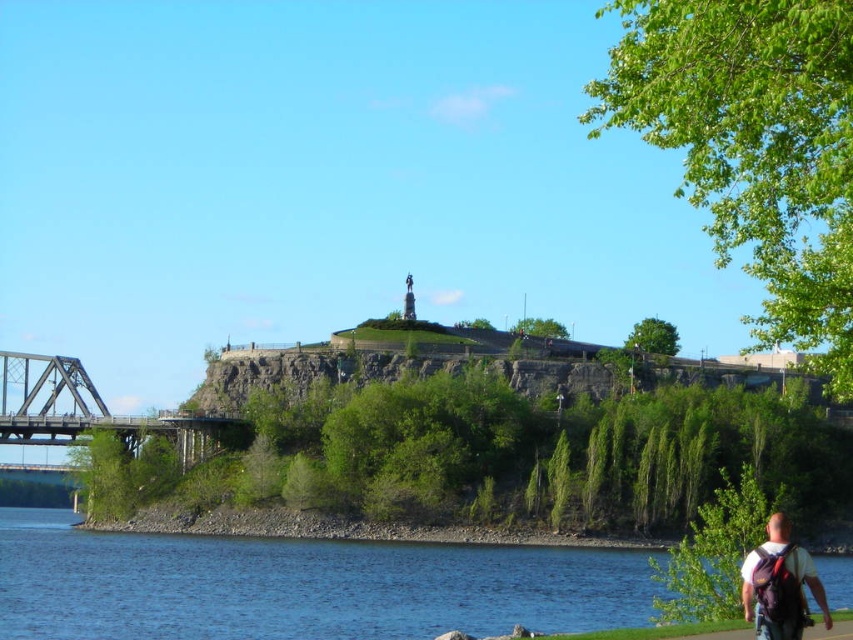
In the scene shown: You are standing at the point labeled as point (299, 586) in the image. Based on the scene description, what can you see around you?

You are standing at point (299, 586), which is located in the blue water at lower left. The surrounding area includes the calm body of water reflecting the blue sky, the metal bridge on the left side of the image, and the scenic riverside view with the hill in the background covered in greenery and the statue atop it.